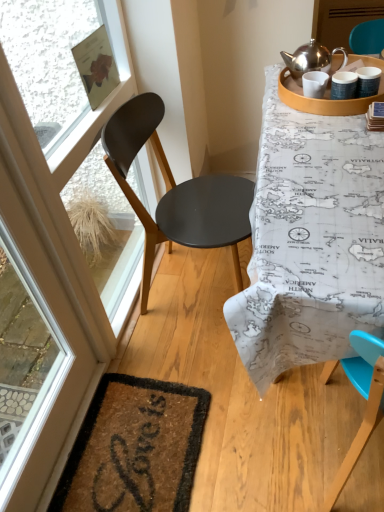
Question: From the image's perspective, would you say matte wooden tray at upper right is shown under transparent glass window screen at upper left?

Choices:
 (A) no
 (B) yes

Answer: (A)

Question: Does matte wooden tray at upper right have a lesser width compared to transparent glass window screen at upper left?

Choices:
 (A) no
 (B) yes

Answer: (A)

Question: From a real-world perspective, does matte wooden tray at upper right sit lower than transparent glass window screen at upper left?

Choices:
 (A) no
 (B) yes

Answer: (A)

Question: Is transparent glass window screen at upper left completely or partially inside matte wooden tray at upper right?

Choices:
 (A) no
 (B) yes

Answer: (A)

Question: Considering the relative sizes of matte wooden tray at upper right and transparent glass window screen at upper left in the image provided, is matte wooden tray at upper right wider than transparent glass window screen at upper left?

Choices:
 (A) yes
 (B) no

Answer: (A)

Question: In terms of height, does matte black chair at left look taller or shorter compared to transparent glass screen door at left, acting as the 2th screen door starting from the top?

Choices:
 (A) tall
 (B) short

Answer: (B)

Question: Is point (230, 178) closer or farther from the camera than point (28, 122)?

Choices:
 (A) farther
 (B) closer

Answer: (A)

Question: From the image's perspective, is matte black chair at left located above or below transparent glass screen door at left, placed as the second screen door when sorted from right to left?

Choices:
 (A) below
 (B) above

Answer: (B)

Question: Considering the positions of matte black chair at left and transparent glass screen door at left, placed as the second screen door when sorted from right to left, in the image, is matte black chair at left wider or thinner than transparent glass screen door at left, placed as the second screen door when sorted from right to left,?

Choices:
 (A) wide
 (B) thin

Answer: (A)

Question: Looking at their shapes, would you say map-patterned tablecloth at upper right is wider or thinner than transparent glass screen door at left, which is the first screen door in bottom-to-top order?

Choices:
 (A) wide
 (B) thin

Answer: (A)

Question: Considering the positions of point (299, 223) and point (120, 50), is point (299, 223) closer or farther from the camera than point (120, 50)?

Choices:
 (A) farther
 (B) closer

Answer: (B)

Question: Is map-patterned tablecloth at upper right in front of or behind transparent glass screen door at left, which is the first screen door in bottom-to-top order, in the image?

Choices:
 (A) behind
 (B) front

Answer: (A)

Question: Based on their sizes in the image, would you say map-patterned tablecloth at upper right is bigger or smaller than transparent glass screen door at left, placed as the second screen door when sorted from right to left?

Choices:
 (A) small
 (B) big

Answer: (B)

Question: Is transparent glass screen door at left, positioned as the 1th screen door in left-to-right order, taller or shorter than map-patterned tablecloth at upper right?

Choices:
 (A) short
 (B) tall

Answer: (B)

Question: Looking at their shapes, would you say transparent glass screen door at left, the first screen door from the front, is wider or thinner than map-patterned tablecloth at upper right?

Choices:
 (A) thin
 (B) wide

Answer: (A)